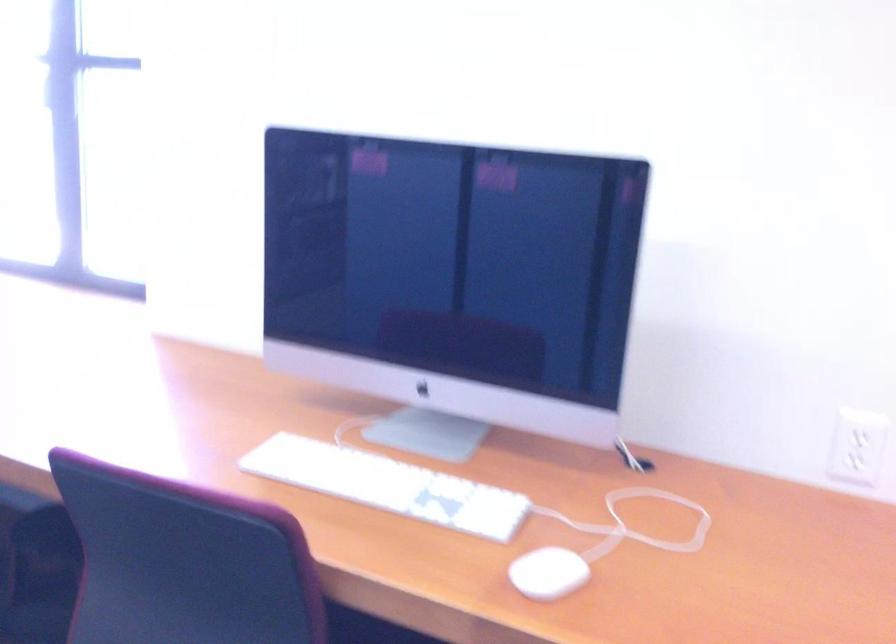
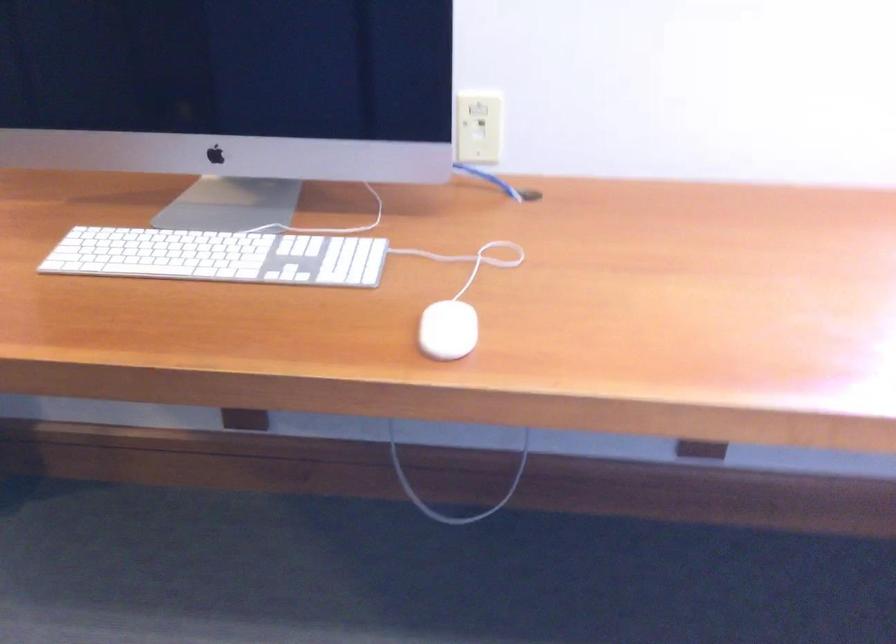
Which direction would the cameraman need to move to produce the second image?

The movement direction of the cameraman is left, forward.